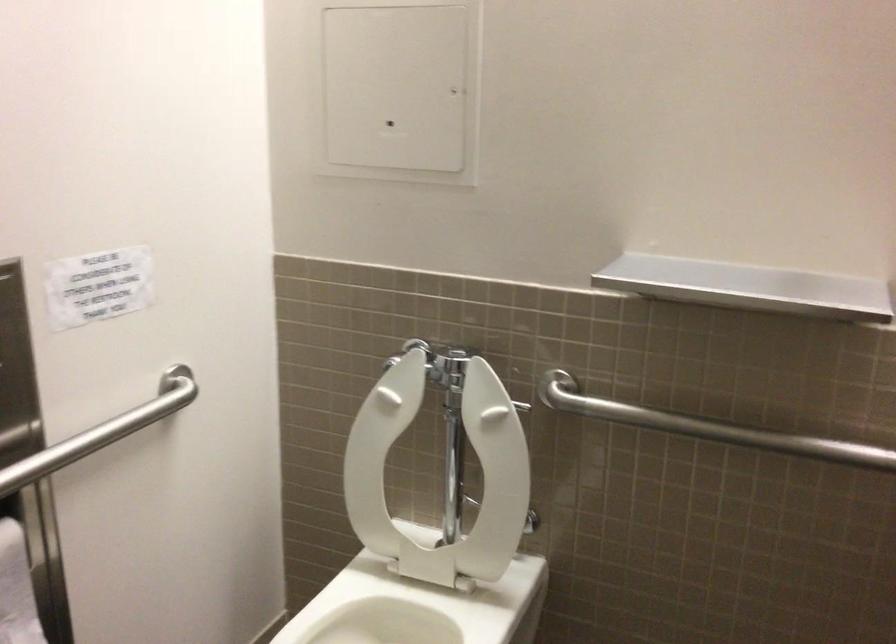
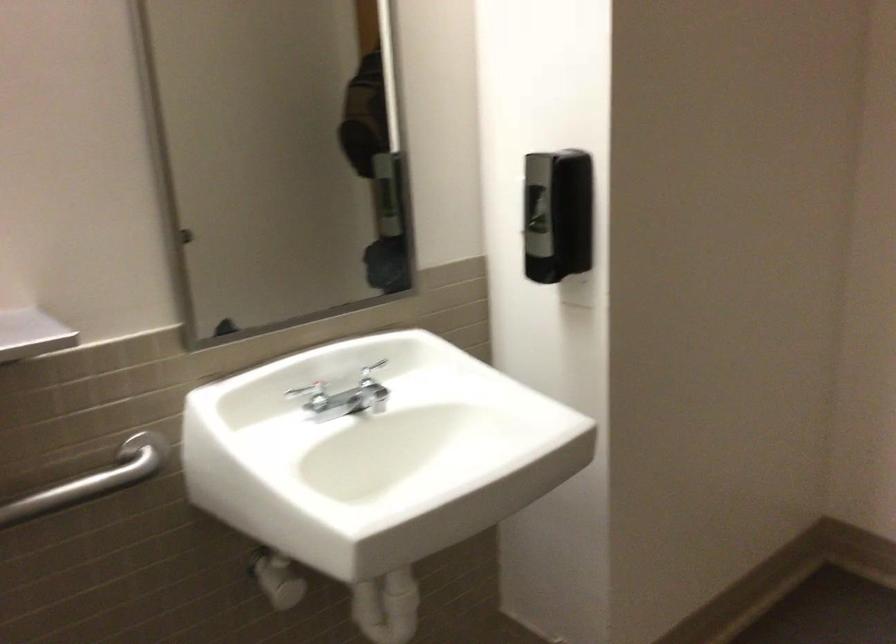
Question: The camera is either moving clockwise (left) or counter-clockwise (right) around the object. The first image is from the beginning of the video and the second image is from the end. Is the camera moving left or right when shooting the video?

Choices:
 (A) Left
 (B) Right

Answer: (A)